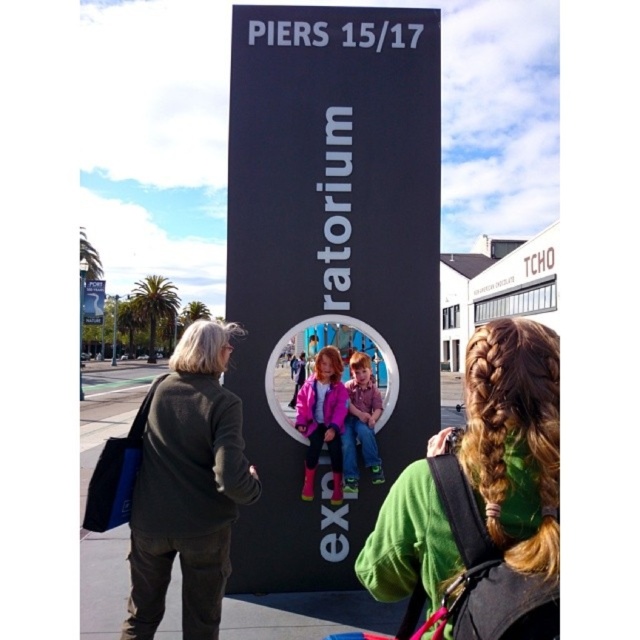
Question: Estimate the real-world distances between objects in this image. Which object is closer to the matte pink jacket at center?

Choices:
 (A) dark gray sweater at left
 (B) metallic sign at upper left

Answer: (A)

Question: Estimate the real-world distances between objects in this image. Which object is farther from the black matte sign at center?

Choices:
 (A) matte pink jacket at center
 (B) dark gray sweater at left
 (C) green fleece jacket at center

Answer: (C)

Question: Is pink rubber boots at center to the right of matte pink jacket at center from the viewer's perspective?

Choices:
 (A) yes
 (B) no

Answer: (B)

Question: Can you confirm if green fleece jacket at center is positioned below dark gray sweater at left?

Choices:
 (A) no
 (B) yes

Answer: (A)

Question: Which object is the closest to the green fleece jacket at center?

Choices:
 (A) dark gray sweater at left
 (B) metallic sign at upper left
 (C) pink rubber boots at center

Answer: (A)

Question: Can you confirm if green fleece jacket at center is smaller than matte pink jacket at center?

Choices:
 (A) yes
 (B) no

Answer: (B)